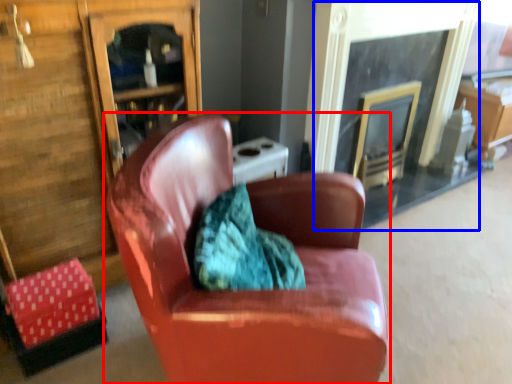
Question: Which of the following is the closest to the observer, chair (highlighted by a red box) or fireplace (highlighted by a blue box)?

Choices:
 (A) chair
 (B) fireplace

Answer: (A)